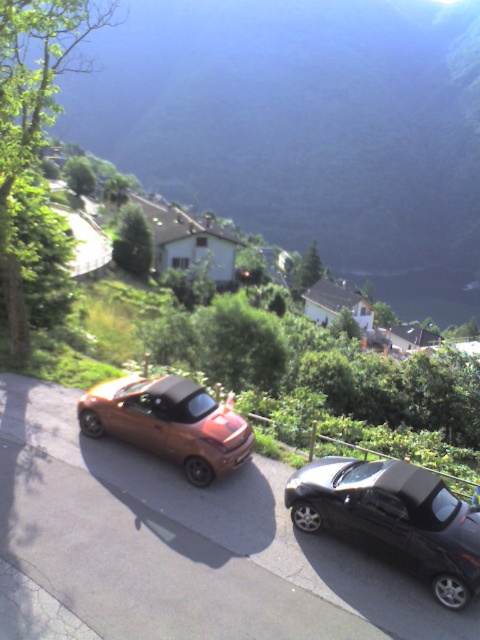
You are a tour guide leading a group of visitors to a scenic viewpoint. You have two convertibles available for transportation. The metallic orange car at center and the matte orange car at center. The distance between them is crucial for parking. Can both cars park side by side without overlapping if each requires 5 feet of space?

The metallic orange car at center is 4.93 feet away from matte orange car at center. Since the required space for both cars is 5 feet, the 4.93 feet distance is insufficient. They cannot park side by side without overlapping.

You are standing at the point marked by point (163, 544) and want to walk to the nearest car. Which car should you head towards?

The point (163, 544) is the location of the metallic orange car at center, so you are already at that car.